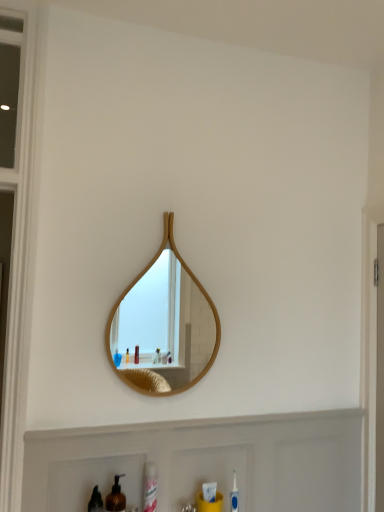
Question: From the image's perspective, is brown matte bottle at lower left on white matte cabinet at lower center?

Choices:
 (A) no
 (B) yes

Answer: (B)

Question: Is brown matte bottle at lower left bigger than white matte cabinet at lower center?

Choices:
 (A) yes
 (B) no

Answer: (B)

Question: Is brown matte bottle at lower left positioned beyond the bounds of white matte cabinet at lower center?

Choices:
 (A) yes
 (B) no

Answer: (A)

Question: Is brown matte bottle at lower left taller than white matte cabinet at lower center?

Choices:
 (A) yes
 (B) no

Answer: (B)

Question: Is brown matte bottle at lower left facing away from white matte cabinet at lower center?

Choices:
 (A) yes
 (B) no

Answer: (A)

Question: Can you confirm if brown matte bottle at lower left is wider than white matte cabinet at lower center?

Choices:
 (A) yes
 (B) no

Answer: (A)

Question: Can you confirm if brown matte bottle at lower left is positioned to the right of wooden mirror at center?

Choices:
 (A) no
 (B) yes

Answer: (A)

Question: From the image's perspective, does brown matte bottle at lower left appear higher than wooden mirror at center?

Choices:
 (A) no
 (B) yes

Answer: (A)

Question: Is wooden mirror at center completely or partially inside brown matte bottle at lower left?

Choices:
 (A) yes
 (B) no

Answer: (B)

Question: From a real-world perspective, does brown matte bottle at lower left sit lower than wooden mirror at center?

Choices:
 (A) yes
 (B) no

Answer: (A)

Question: From the image's perspective, is brown matte bottle at lower left beneath wooden mirror at center?

Choices:
 (A) yes
 (B) no

Answer: (A)

Question: Does brown matte bottle at lower left have a greater height compared to wooden mirror at center?

Choices:
 (A) yes
 (B) no

Answer: (B)

Question: From a real-world perspective, is white matte cabinet at lower center beneath brown matte bottle at lower left?

Choices:
 (A) yes
 (B) no

Answer: (B)